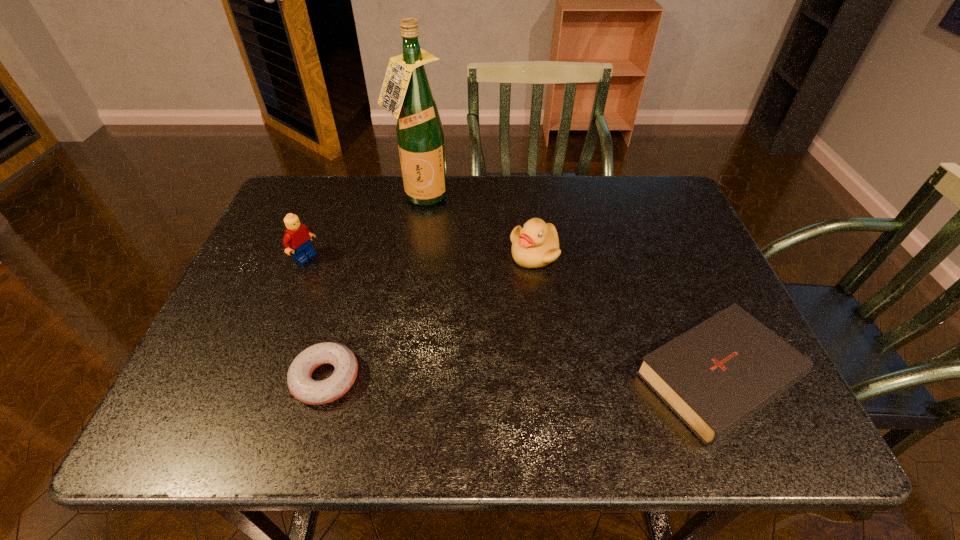
Where is `free spot at the far right corner of the desktop`? The height and width of the screenshot is (540, 960). free spot at the far right corner of the desktop is located at coordinates (654, 213).

Find the location of `empty space that is in between the fourth object from left to right and the rightmost object`. empty space that is in between the fourth object from left to right and the rightmost object is located at coordinates (632, 315).

The height and width of the screenshot is (540, 960). I want to click on free space between the shortest object and the leftmost object, so click(316, 318).

Image resolution: width=960 pixels, height=540 pixels. Identify the location of free space that is in between the second shortest object and the shortest object. [528, 377].

This screenshot has height=540, width=960. In order to click on vacant space in between the Bible and the doughnut in this screenshot , I will do `click(528, 377)`.

Locate an element on the screen. The width and height of the screenshot is (960, 540). free space between the Lego and the farthest object is located at coordinates (363, 228).

At what (x,y) coordinates should I click in order to perform the action: click on free space between the Bible and the liquor. Please return your answer as a coordinate pair (x, y). Looking at the image, I should click on (575, 288).

This screenshot has width=960, height=540. Identify the location of vacant area that lies between the third shortest object and the tallest object. (477, 226).

The image size is (960, 540). What are the coordinates of `vacant region between the farthest object and the rightmost object` in the screenshot? It's located at (575, 288).

Find the location of a particular element. unoccupied position between the shortest object and the liquor is located at coordinates point(373,288).